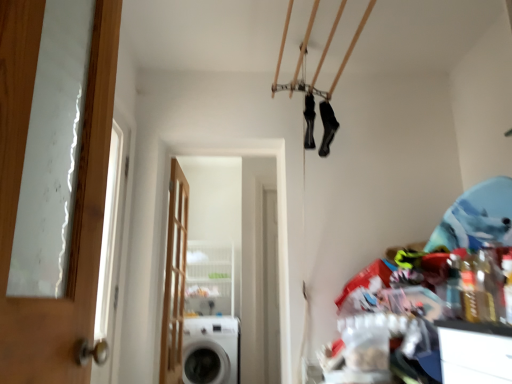
Question: Is white glossy washing machine at lower center not inside wooden door at center, the second door viewed from the front?

Choices:
 (A) yes
 (B) no

Answer: (A)

Question: Is white glossy washing machine at lower center touching wooden door at center, which ranks as the first door in left-to-right order?

Choices:
 (A) yes
 (B) no

Answer: (B)

Question: Is white glossy washing machine at lower center thinner than wooden door at center, which is the second door from right to left?

Choices:
 (A) yes
 (B) no

Answer: (B)

Question: Does white glossy washing machine at lower center have a greater width compared to wooden door at center, the 1th door from the back?

Choices:
 (A) yes
 (B) no

Answer: (A)

Question: Would you say white glossy washing machine at lower center contains wooden door at center, the 1th door from the back?

Choices:
 (A) no
 (B) yes

Answer: (A)

Question: From a real-world perspective, is white glossy screen door at center positioned above or below white glossy washing machine at lower center?

Choices:
 (A) above
 (B) below

Answer: (A)

Question: Does point (203, 152) appear closer or farther from the camera than point (214, 327)?

Choices:
 (A) closer
 (B) farther

Answer: (A)

Question: Choose the correct answer: Is white glossy screen door at center inside white glossy washing machine at lower center or outside it?

Choices:
 (A) inside
 (B) outside

Answer: (B)

Question: Considering their positions, is white glossy screen door at center located in front of or behind white glossy washing machine at lower center?

Choices:
 (A) behind
 (B) front

Answer: (B)

Question: Considering the positions of black matte socks at upper center, the second shoe from the left, and white glossy washing machine at lower center in the image, is black matte socks at upper center, the second shoe from the left, taller or shorter than white glossy washing machine at lower center?

Choices:
 (A) short
 (B) tall

Answer: (A)

Question: Is point (327, 127) closer or farther from the camera than point (224, 350)?

Choices:
 (A) closer
 (B) farther

Answer: (A)

Question: Is black matte socks at upper center, which ranks as the 1th shoe in right-to-left order, to the left or to the right of white glossy washing machine at lower center in the image?

Choices:
 (A) left
 (B) right

Answer: (B)

Question: From a real-world perspective, is black matte socks at upper center, the second shoe from the left, physically located above or below white glossy washing machine at lower center?

Choices:
 (A) below
 (B) above

Answer: (B)

Question: Is white glossy screen door at center to the left or to the right of wooden door at center, which is the second door from right to left, in the image?

Choices:
 (A) left
 (B) right

Answer: (B)

Question: Considering the positions of white glossy screen door at center and wooden door at center, which ranks as the first door in left-to-right order, in the image, is white glossy screen door at center taller or shorter than wooden door at center, which ranks as the first door in left-to-right order,?

Choices:
 (A) tall
 (B) short

Answer: (B)